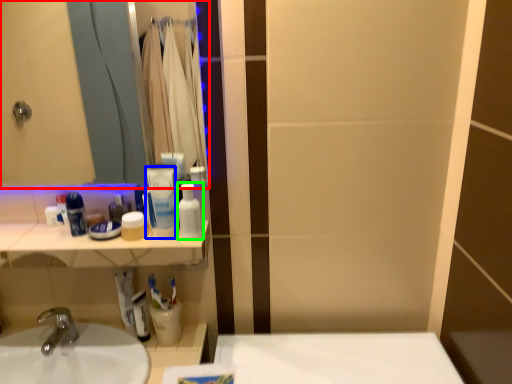
Question: Estimate the real-world distances between objects in this image. Which object is closer to mirror (highlighted by a red box), mouthwash (highlighted by a blue box) or mouthwash (highlighted by a green box)?

Choices:
 (A) mouthwash
 (B) mouthwash

Answer: (A)